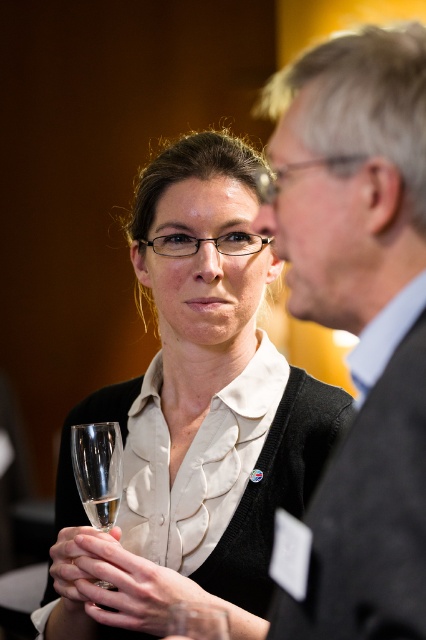
You are a photographer adjusting your camera settings. You notice the transparent glass at lower left in the frame. Based on its distance from the camera, can you estimate whether the glass is within the camera focus range of 1 meter? Please explain your reasoning.

The transparent glass at lower left is 92.12 centimeters away from the camera. Since the focus range is 1 meter, the glass is within range as it is closer than 1 meter.

You are a photographer trying to capture a close shot of the black plastic glasses at center in the image. However, the matte black sweater at center is blocking your view. Can you move the sweater to the right to clear the line of sight?

The matte black sweater at center is to the left of black plastic glasses at center, so moving the sweater to the right would clear the line of sight to the black plastic glasses at center.

What is located at the coordinates point (199, 401)?

The point (199, 401) is occupied by the matte black sweater at center.